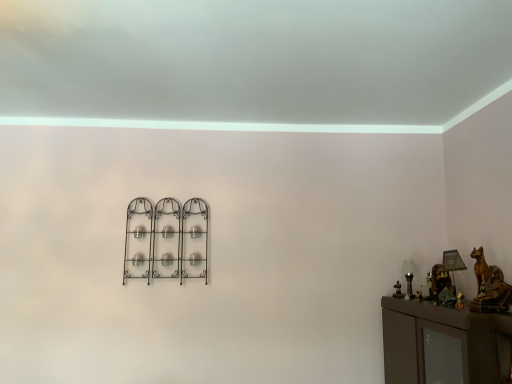
How much space does white glass table lamp at right, which ranks as the 1th table lamp in back-to-front order, occupy horizontally?

3.33 inches.

This screenshot has width=512, height=384. Describe the element at coordinates (453, 264) in the screenshot. I see `metallic gold table lamp at right, placed as the second table lamp when sorted from back to front` at that location.

In order to face black wrought iron candle holder at center, should I rotate leftwards or rightwards?

To align with it, rotate left about 11.815°.

The image size is (512, 384). I want to click on white glass table lamp at right, arranged as the second table lamp when viewed from the right, so click(x=409, y=276).

From the image's perspective, would you say metallic gold table lamp at right, which appears as the second table lamp when viewed from the left, is positioned over black wrought iron candle holder at center?

No, from the image's perspective, metallic gold table lamp at right, which appears as the second table lamp when viewed from the left, is not above black wrought iron candle holder at center.

Can you tell me how much metallic gold table lamp at right, which appears as the second table lamp when viewed from the left, and black wrought iron candle holder at center differ in facing direction?

The facing directions of metallic gold table lamp at right, which appears as the second table lamp when viewed from the left, and black wrought iron candle holder at center are 89.6 degrees apart.

Between metallic gold table lamp at right, marked as the first table lamp in a right-to-left arrangement, and black wrought iron candle holder at center, which one is positioned behind?

black wrought iron candle holder at center.

Considering the relative sizes of metallic gold table lamp at right, placed as the second table lamp when sorted from back to front, and black wrought iron candle holder at center in the image provided, is metallic gold table lamp at right, placed as the second table lamp when sorted from back to front, smaller than black wrought iron candle holder at center?

Correct, metallic gold table lamp at right, placed as the second table lamp when sorted from back to front, occupies less space than black wrought iron candle holder at center.

Which of these two, white glass table lamp at right, which ranks as the 1th table lamp in back-to-front order, or metallic gold table lamp at right, marked as the first table lamp in a right-to-left arrangement, is bigger?

Bigger between the two is metallic gold table lamp at right, marked as the first table lamp in a right-to-left arrangement.

Is white glass table lamp at right, which ranks as the 1th table lamp in back-to-front order, at the right side of metallic gold table lamp at right, marked as the first table lamp in a right-to-left arrangement?

Incorrect, white glass table lamp at right, which ranks as the 1th table lamp in back-to-front order, is not on the right side of metallic gold table lamp at right, marked as the first table lamp in a right-to-left arrangement.

Does point (204, 227) come behind point (449, 264)?

Yes, point (204, 227) is behind point (449, 264).

From a real-world perspective, is black wrought iron candle holder at center physically below metallic gold table lamp at right, the 1th table lamp positioned from the front?

Actually, black wrought iron candle holder at center is physically above metallic gold table lamp at right, the 1th table lamp positioned from the front, in the real world.

From a real-world perspective, is white glass table lamp at right, which ranks as the 1th table lamp in back-to-front order, on top of black wrought iron candle holder at center?

No, from a real-world perspective, white glass table lamp at right, which ranks as the 1th table lamp in back-to-front order, is not above black wrought iron candle holder at center.

Which object is positioned more to the left, white glass table lamp at right, which ranks as the 1th table lamp in back-to-front order, or black wrought iron candle holder at center?

From the viewer's perspective, black wrought iron candle holder at center appears more on the left side.

Is white glass table lamp at right, arranged as the second table lamp when viewed from the right, further to the viewer compared to black wrought iron candle holder at center?

No, white glass table lamp at right, arranged as the second table lamp when viewed from the right, is closer to the viewer.

Locate an element on the screen. The height and width of the screenshot is (384, 512). table lamp that is the 1st one when counting forward from the black wrought iron candle holder at center is located at coordinates (409, 276).

From a real-world perspective, between metallic gold table lamp at right, which appears as the second table lamp when viewed from the left, and white glass table lamp at right, arranged as the second table lamp when viewed from the right, who is vertically lower?

white glass table lamp at right, arranged as the second table lamp when viewed from the right, from a real-world perspective.

Could you tell me if metallic gold table lamp at right, placed as the second table lamp when sorted from back to front, is turned towards white glass table lamp at right, the 2th table lamp when ordered from front to back?

No, metallic gold table lamp at right, placed as the second table lamp when sorted from back to front, is not turned towards white glass table lamp at right, the 2th table lamp when ordered from front to back.

Can you confirm if metallic gold table lamp at right, marked as the first table lamp in a right-to-left arrangement, is positioned to the left of white glass table lamp at right, arranged as the second table lamp when viewed from the right?

No.

Looking at this image, is metallic gold table lamp at right, which appears as the second table lamp when viewed from the left, situated inside white glass table lamp at right, which ranks as the 1th table lamp in back-to-front order, or outside?

metallic gold table lamp at right, which appears as the second table lamp when viewed from the left, is outside white glass table lamp at right, which ranks as the 1th table lamp in back-to-front order.

Is black wrought iron candle holder at center aimed at white glass table lamp at right, which ranks as the 1th table lamp in back-to-front order?

No, black wrought iron candle holder at center is not turned towards white glass table lamp at right, which ranks as the 1th table lamp in back-to-front order.

From the image's perspective, which is below, black wrought iron candle holder at center or white glass table lamp at right, which is counted as the first table lamp, starting from the left?

white glass table lamp at right, which is counted as the first table lamp, starting from the left, appears lower in the image.

Could you measure the distance between black wrought iron candle holder at center and white glass table lamp at right, which ranks as the 1th table lamp in back-to-front order?

black wrought iron candle holder at center is 1.36 meters from white glass table lamp at right, which ranks as the 1th table lamp in back-to-front order.

From the black wrought iron candle holder at center, count 2nd table lamp to the right and point to it. Please provide its 2D coordinates.

[(453, 264)]

You are a GUI agent. You are given a task and a screenshot of the screen. Output one action in this format:
    pyautogui.click(x=<x>, y=<y>)
    Task: Click on the table lamp on the left side of metallic gold table lamp at right, marked as the first table lamp in a right-to-left arrangement
    Image resolution: width=512 pixels, height=384 pixels.
    Given the screenshot: What is the action you would take?
    pyautogui.click(x=409, y=276)

Which object lies further to the anchor point white glass table lamp at right, which is counted as the first table lamp, starting from the left, metallic gold table lamp at right, marked as the first table lamp in a right-to-left arrangement, or black wrought iron candle holder at center?

black wrought iron candle holder at center.

From the image, which object appears to be nearer to black wrought iron candle holder at center, white glass table lamp at right, the 2th table lamp when ordered from front to back, or metallic gold table lamp at right, which appears as the second table lamp when viewed from the left?

Among the two, white glass table lamp at right, the 2th table lamp when ordered from front to back, is located nearer to black wrought iron candle holder at center.

Based on their spatial positions, is metallic gold table lamp at right, which appears as the second table lamp when viewed from the left, or white glass table lamp at right, arranged as the second table lamp when viewed from the right, closer to black wrought iron candle holder at center?

white glass table lamp at right, arranged as the second table lamp when viewed from the right, is closer to black wrought iron candle holder at center.

Based on their spatial positions, is black wrought iron candle holder at center or white glass table lamp at right, which ranks as the 1th table lamp in back-to-front order, further from metallic gold table lamp at right, marked as the first table lamp in a right-to-left arrangement?

black wrought iron candle holder at center lies further to metallic gold table lamp at right, marked as the first table lamp in a right-to-left arrangement, than the other object.

Considering their positions, is black wrought iron candle holder at center positioned closer to white glass table lamp at right, which is counted as the first table lamp, starting from the left, than metallic gold table lamp at right, which appears as the second table lamp when viewed from the left?

Among the two, metallic gold table lamp at right, which appears as the second table lamp when viewed from the left, is located nearer to white glass table lamp at right, which is counted as the first table lamp, starting from the left.

Looking at this image, which object lies further to the anchor point metallic gold table lamp at right, which appears as the second table lamp when viewed from the left, white glass table lamp at right, the 2th table lamp when ordered from front to back, or black wrought iron candle holder at center?

black wrought iron candle holder at center is further to metallic gold table lamp at right, which appears as the second table lamp when viewed from the left.

You are a GUI agent. You are given a task and a screenshot of the screen. Output one action in this format:
    pyautogui.click(x=<x>, y=<y>)
    Task: Click on the table lamp between black wrought iron candle holder at center and metallic gold table lamp at right, which appears as the second table lamp when viewed from the left
    
    Given the screenshot: What is the action you would take?
    pyautogui.click(x=409, y=276)